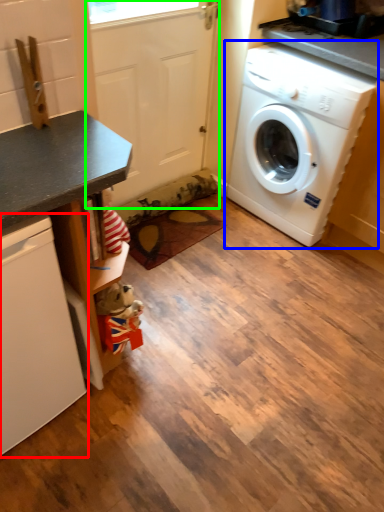
Question: Estimate the real-world distances between objects in this image. Which object is farther from dish washer (highlighted by a red box), washing machine (highlighted by a blue box) or screen door (highlighted by a green box)?

Choices:
 (A) washing machine
 (B) screen door

Answer: (A)